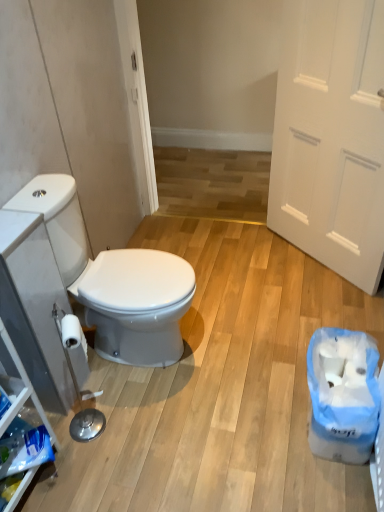
Locate an element on the screen. empty space that is in between white matte door at right and blue plastic bag at lower right is located at coordinates (302, 304).